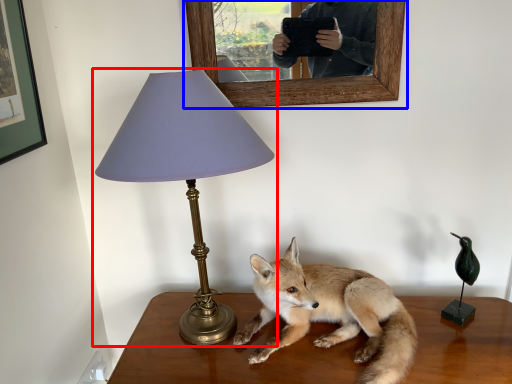
Question: Which point is further to the camera, lamp (highlighted by a red box) or picture frame (highlighted by a blue box)?

Choices:
 (A) lamp
 (B) picture frame

Answer: (B)